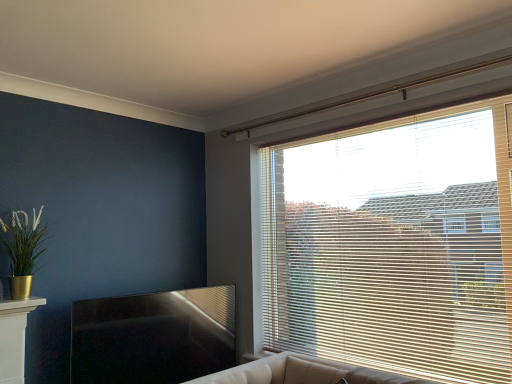
Describe the element at coordinates (393, 244) in the screenshot. This screenshot has width=512, height=384. I see `wooden blinds at upper right` at that location.

This screenshot has width=512, height=384. I want to click on wooden blinds at upper right, so click(393, 244).

Measure the distance between gold metallic pot at left and camera.

gold metallic pot at left is 7.54 feet from camera.

Image resolution: width=512 pixels, height=384 pixels. What do you see at coordinates (23, 249) in the screenshot? I see `gold metallic pot at left` at bounding box center [23, 249].

What is the approximate width of gold metallic pot at left?

gold metallic pot at left is 7.89 inches wide.

Image resolution: width=512 pixels, height=384 pixels. I want to click on gold metallic pot at left, so click(x=23, y=249).

At what (x,y) coordinates should I click in order to perform the action: click on wooden blinds at upper right. Please return your answer as a coordinate pair (x, y). Looking at the image, I should click on (393, 244).

In the scene shown: Does wooden blinds at upper right appear on the left side of gold metallic pot at left?

No.

Consider the image. Which is behind, wooden blinds at upper right or gold metallic pot at left?

Positioned behind is gold metallic pot at left.

Considering the positions of point (313, 227) and point (37, 217), is point (313, 227) closer or farther from the camera than point (37, 217)?

Point (313, 227) is farther from the camera than point (37, 217).

From the image's perspective, which one is positioned higher, wooden blinds at upper right or gold metallic pot at left?

From the image's view, wooden blinds at upper right is above.

From a real-world perspective, which is physically below, wooden blinds at upper right or gold metallic pot at left?

In real-world perspective, wooden blinds at upper right is lower.

Which object is thinner, wooden blinds at upper right or gold metallic pot at left?

wooden blinds at upper right is thinner.

From their relative heights in the image, would you say wooden blinds at upper right is taller or shorter than gold metallic pot at left?

Considering their sizes, wooden blinds at upper right has more height than gold metallic pot at left.

Looking at this image, considering the relative sizes of wooden blinds at upper right and gold metallic pot at left in the image provided, is wooden blinds at upper right bigger than gold metallic pot at left?

Yes.

Is wooden blinds at upper right located outside gold metallic pot at left?

Yes, wooden blinds at upper right is outside of gold metallic pot at left.

Would you say wooden blinds at upper right is a long distance from gold metallic pot at left?

wooden blinds at upper right is positioned a significant distance from gold metallic pot at left.

In the scene shown: Is wooden blinds at upper right facing away from gold metallic pot at left?

No, wooden blinds at upper right is not facing away from gold metallic pot at left.

The width and height of the screenshot is (512, 384). I want to click on window blind below the gold metallic pot at left (from a real-world perspective), so click(x=393, y=244).

Considering the positions of objects gold metallic pot at left and wooden blinds at upper right in the image provided, who is more to the left, gold metallic pot at left or wooden blinds at upper right?

From the viewer's perspective, gold metallic pot at left appears more on the left side.

Considering their positions, is gold metallic pot at left located in front of or behind wooden blinds at upper right?

Visually, gold metallic pot at left is located behind wooden blinds at upper right.

Which is behind, point (15, 282) or point (449, 342)?

Point (15, 282)

From the image's perspective, is gold metallic pot at left below wooden blinds at upper right?

Yes, from the image's perspective, gold metallic pot at left is below wooden blinds at upper right.

From a real-world perspective, who is located lower, gold metallic pot at left or wooden blinds at upper right?

From a 3D spatial view, wooden blinds at upper right is below.

Which of these two, gold metallic pot at left or wooden blinds at upper right, is wider?

gold metallic pot at left is wider.

Is gold metallic pot at left shorter than wooden blinds at upper right?

Correct, gold metallic pot at left is not as tall as wooden blinds at upper right.

In the scene shown: Between gold metallic pot at left and wooden blinds at upper right, which one has smaller size?

With smaller size is gold metallic pot at left.

Is gold metallic pot at left located outside wooden blinds at upper right?

That's correct, gold metallic pot at left is outside of wooden blinds at upper right.

Is gold metallic pot at left with wooden blinds at upper right?

No, gold metallic pot at left is not making contact with wooden blinds at upper right.

Is gold metallic pot at left oriented towards wooden blinds at upper right?

No.

How different are the orientations of gold metallic pot at left and wooden blinds at upper right in degrees?

90.4 degrees separate the facing orientations of gold metallic pot at left and wooden blinds at upper right.

The width and height of the screenshot is (512, 384). In order to click on houseplant behind the wooden blinds at upper right in this screenshot , I will do [23, 249].

I want to click on houseplant located above the wooden blinds at upper right (from a real-world perspective), so click(x=23, y=249).

This screenshot has width=512, height=384. I want to click on houseplant below the wooden blinds at upper right (from the image's perspective), so click(23, 249).